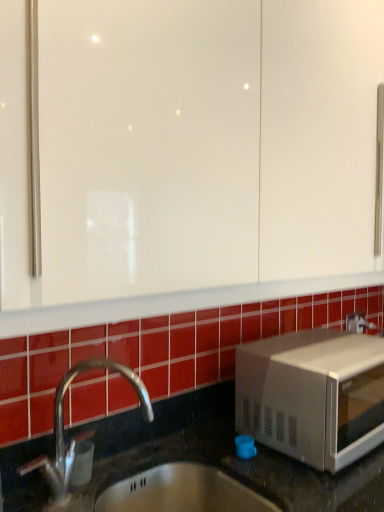
Question: Does clear plastic soap dispenser at lower left appear on the right side of white matte microwave at lower right?

Choices:
 (A) yes
 (B) no

Answer: (B)

Question: Is clear plastic soap dispenser at lower left not within white matte microwave at lower right?

Choices:
 (A) yes
 (B) no

Answer: (A)

Question: Considering the relative sizes of clear plastic soap dispenser at lower left and white matte microwave at lower right in the image provided, is clear plastic soap dispenser at lower left taller than white matte microwave at lower right?

Choices:
 (A) no
 (B) yes

Answer: (A)

Question: Does clear plastic soap dispenser at lower left appear on the left side of white matte microwave at lower right?

Choices:
 (A) yes
 (B) no

Answer: (A)

Question: Are clear plastic soap dispenser at lower left and white matte microwave at lower right far apart?

Choices:
 (A) no
 (B) yes

Answer: (A)

Question: Is clear plastic soap dispenser at lower left wider than white matte microwave at lower right?

Choices:
 (A) yes
 (B) no

Answer: (B)

Question: Is white matte microwave at lower right turned away from clear plastic soap dispenser at lower left?

Choices:
 (A) no
 (B) yes

Answer: (A)

Question: From a real-world perspective, is white matte microwave at lower right physically below clear plastic soap dispenser at lower left?

Choices:
 (A) yes
 (B) no

Answer: (B)

Question: From the image's perspective, is white matte microwave at lower right over clear plastic soap dispenser at lower left?

Choices:
 (A) yes
 (B) no

Answer: (A)

Question: Are white matte microwave at lower right and clear plastic soap dispenser at lower left beside each other?

Choices:
 (A) yes
 (B) no

Answer: (B)

Question: From a real-world perspective, is white matte microwave at lower right physically above clear plastic soap dispenser at lower left?

Choices:
 (A) no
 (B) yes

Answer: (B)

Question: Considering the relative sizes of white matte microwave at lower right and clear plastic soap dispenser at lower left in the image provided, is white matte microwave at lower right taller than clear plastic soap dispenser at lower left?

Choices:
 (A) yes
 (B) no

Answer: (A)

Question: From their relative heights in the image, would you say white matte microwave at lower right is taller or shorter than clear plastic soap dispenser at lower left?

Choices:
 (A) tall
 (B) short

Answer: (A)